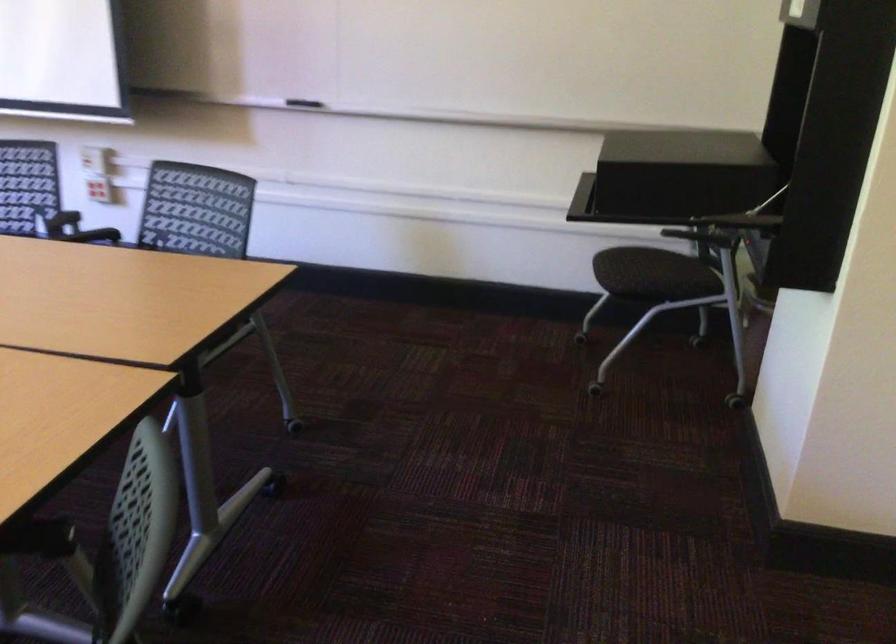
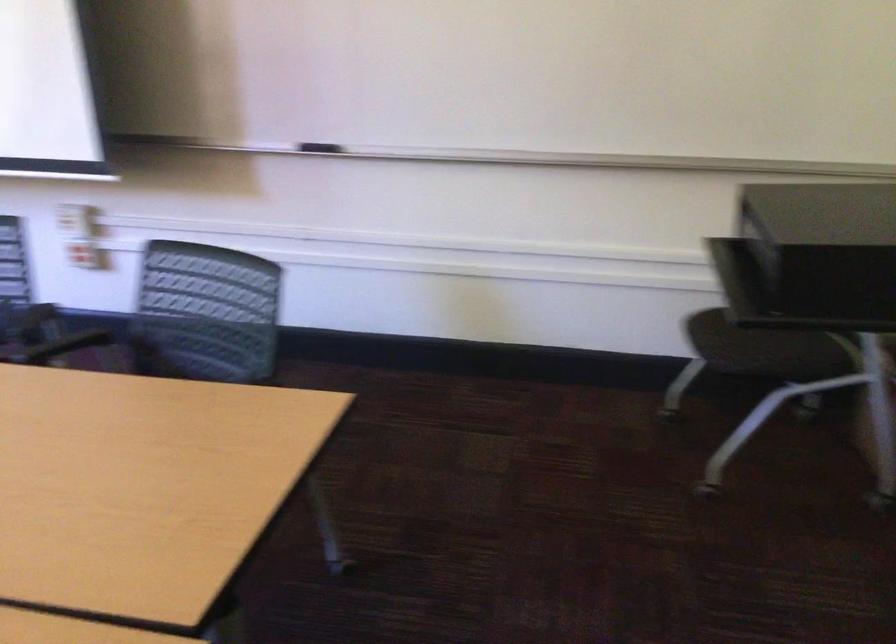
Question: Based on the continuous images, in which direction is the camera rotating? Reply with the corresponding letter.

Choices:
 (A) Left
 (B) Right
 (C) Up
 (D) Down

Answer: (C)